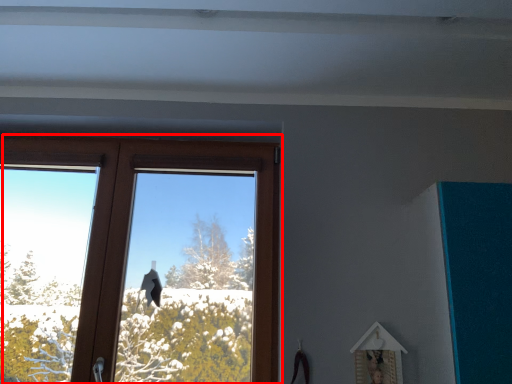
Question: Considering the relative positions of window (annotated by the red box) and picture frame in the image provided, where is window (annotated by the red box) located with respect to the staircase?

Choices:
 (A) right
 (B) left

Answer: (B)